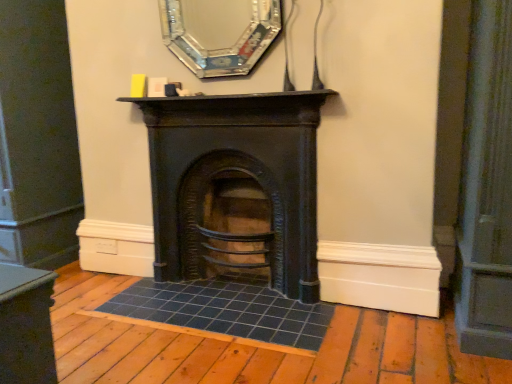
The width and height of the screenshot is (512, 384). Describe the element at coordinates (221, 48) in the screenshot. I see `silver metallic mirror at upper center` at that location.

Find the location of a particular element. This screenshot has height=384, width=512. silver metallic mirror at upper center is located at coordinates (221, 48).

What is the approximate width of black cast iron fireplace at center?

black cast iron fireplace at center is 13.03 inches wide.

Where is `black cast iron fireplace at center`? black cast iron fireplace at center is located at coordinates (236, 179).

What do you see at coordinates (236, 179) in the screenshot? I see `black cast iron fireplace at center` at bounding box center [236, 179].

This screenshot has width=512, height=384. I want to click on silver metallic mirror at upper center, so coord(221,48).

Considering the positions of objects silver metallic mirror at upper center and black cast iron fireplace at center in the image provided, who is more to the left, silver metallic mirror at upper center or black cast iron fireplace at center?

Positioned to the left is silver metallic mirror at upper center.

Which object is more forward, silver metallic mirror at upper center or black cast iron fireplace at center?

silver metallic mirror at upper center is closer to the camera.

Is point (196, 62) positioned in front of point (316, 199)?

No.

From the image's perspective, does silver metallic mirror at upper center appear higher than black cast iron fireplace at center?

Yes, from the image's perspective, silver metallic mirror at upper center is on top of black cast iron fireplace at center.

From a real-world perspective, who is located lower, silver metallic mirror at upper center or black cast iron fireplace at center?

In real-world perspective, black cast iron fireplace at center is lower.

Considering the sizes of silver metallic mirror at upper center and black cast iron fireplace at center in the image, is silver metallic mirror at upper center wider or thinner than black cast iron fireplace at center?

Clearly, silver metallic mirror at upper center has less width compared to black cast iron fireplace at center.

Considering the sizes of objects silver metallic mirror at upper center and black cast iron fireplace at center in the image provided, who is shorter, silver metallic mirror at upper center or black cast iron fireplace at center?

Standing shorter between the two is silver metallic mirror at upper center.

Based on the photo, is silver metallic mirror at upper center bigger or smaller than black cast iron fireplace at center?

Clearly, silver metallic mirror at upper center is smaller in size than black cast iron fireplace at center.

Do you think silver metallic mirror at upper center is within black cast iron fireplace at center, or outside of it?

silver metallic mirror at upper center cannot be found inside black cast iron fireplace at center.

Is silver metallic mirror at upper center not close to black cast iron fireplace at center?

silver metallic mirror at upper center is near black cast iron fireplace at center, not far away.

Is silver metallic mirror at upper center oriented towards black cast iron fireplace at center?

No.

Locate an element on the screen. The image size is (512, 384). mirror above the black cast iron fireplace at center (from a real-world perspective) is located at coordinates (221, 48).

Is black cast iron fireplace at center to the right of silver metallic mirror at upper center from the viewer's perspective?

Indeed, black cast iron fireplace at center is positioned on the right side of silver metallic mirror at upper center.

Does black cast iron fireplace at center lie behind silver metallic mirror at upper center?

Yes.

Which is in front, point (277, 243) or point (170, 13)?

Positioned in front is point (170, 13).

From the image's perspective, is black cast iron fireplace at center below silver metallic mirror at upper center?

Yes, from the image's perspective, black cast iron fireplace at center is beneath silver metallic mirror at upper center.

From a real-world perspective, between black cast iron fireplace at center and silver metallic mirror at upper center, who is vertically lower?

black cast iron fireplace at center.

Considering the relative sizes of black cast iron fireplace at center and silver metallic mirror at upper center in the image provided, is black cast iron fireplace at center wider than silver metallic mirror at upper center?

Yes, black cast iron fireplace at center is wider than silver metallic mirror at upper center.

Is black cast iron fireplace at center taller than silver metallic mirror at upper center?

Yes, black cast iron fireplace at center is taller than silver metallic mirror at upper center.

Is black cast iron fireplace at center bigger than silver metallic mirror at upper center?

Yes, black cast iron fireplace at center is bigger than silver metallic mirror at upper center.

Is black cast iron fireplace at center positioned beyond the bounds of silver metallic mirror at upper center?

Absolutely, black cast iron fireplace at center is external to silver metallic mirror at upper center.

Is black cast iron fireplace at center far from silver metallic mirror at upper center?

No, black cast iron fireplace at center is in close proximity to silver metallic mirror at upper center.

Is black cast iron fireplace at center positioned with its back to silver metallic mirror at upper center?

black cast iron fireplace at center is not turned away from silver metallic mirror at upper center.

Locate an element on the screen. mirror that appears in front of the black cast iron fireplace at center is located at coordinates (221, 48).

In order to click on mirror above the black cast iron fireplace at center (from the image's perspective) in this screenshot , I will do `click(221, 48)`.

Identify the location of fireplace on the right of the silver metallic mirror at upper center. This screenshot has height=384, width=512. (236, 179).